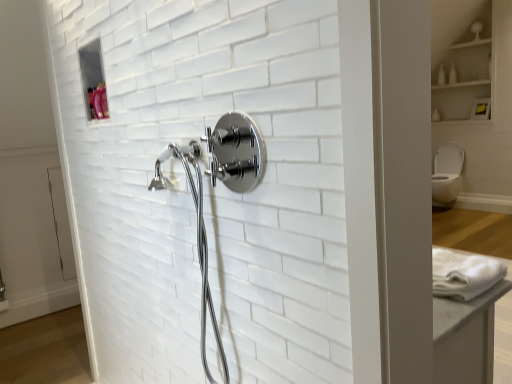
Question: Is white glossy cabinet at upper right positioned behind chrome/metallic showerhead at center?

Choices:
 (A) yes
 (B) no

Answer: (A)

Question: Is white glossy cabinet at upper right at the left side of chrome/metallic showerhead at center?

Choices:
 (A) no
 (B) yes

Answer: (A)

Question: Are white glossy cabinet at upper right and chrome/metallic showerhead at center beside each other?

Choices:
 (A) yes
 (B) no

Answer: (B)

Question: Does white glossy cabinet at upper right have a greater height compared to chrome/metallic showerhead at center?

Choices:
 (A) yes
 (B) no

Answer: (A)

Question: Is chrome/metallic showerhead at center at the back of white glossy cabinet at upper right?

Choices:
 (A) no
 (B) yes

Answer: (A)

Question: Looking at the image, does white glossy toilet bowl at right seem bigger or smaller compared to white glossy bottle at upper right?

Choices:
 (A) small
 (B) big

Answer: (B)

Question: Would you say white glossy toilet bowl at right is inside or outside white glossy bottle at upper right?

Choices:
 (A) outside
 (B) inside

Answer: (A)

Question: Is white glossy toilet bowl at right in front of or behind white glossy bottle at upper right in the image?

Choices:
 (A) behind
 (B) front

Answer: (B)

Question: Considering the positions of white glossy toilet bowl at right and white glossy bottle at upper right in the image, is white glossy toilet bowl at right taller or shorter than white glossy bottle at upper right?

Choices:
 (A) tall
 (B) short

Answer: (A)

Question: Is white glossy cabinet at upper right taller or shorter than chrome/metallic showerhead at center?

Choices:
 (A) short
 (B) tall

Answer: (B)

Question: Considering their positions, is white glossy cabinet at upper right located in front of or behind chrome/metallic showerhead at center?

Choices:
 (A) behind
 (B) front

Answer: (A)

Question: Considering the positions of point (489, 56) and point (256, 155), is point (489, 56) closer or farther from the camera than point (256, 155)?

Choices:
 (A) closer
 (B) farther

Answer: (B)

Question: From a real-world perspective, is white glossy cabinet at upper right positioned above or below chrome/metallic showerhead at center?

Choices:
 (A) above
 (B) below

Answer: (A)

Question: Considering the positions of chrome/metallic showerhead at center and white glossy bottle at upper right in the image, is chrome/metallic showerhead at center bigger or smaller than white glossy bottle at upper right?

Choices:
 (A) small
 (B) big

Answer: (B)

Question: Is chrome/metallic showerhead at center to the left or to the right of white glossy bottle at upper right in the image?

Choices:
 (A) right
 (B) left

Answer: (B)